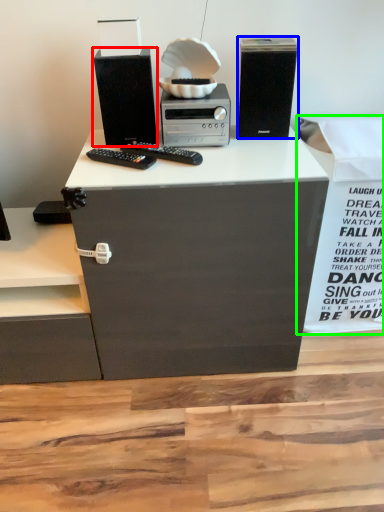
Question: Estimate the real-world distances between objects in this image. Which object is closer to computer tower (highlighted by a red box), computer tower (highlighted by a blue box) or cardboard box (highlighted by a green box)?

Choices:
 (A) computer tower
 (B) cardboard box

Answer: (A)